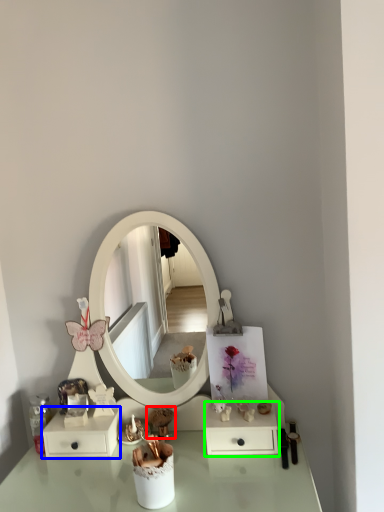
Question: Estimate the real-world distances between objects in this image. Which object is closer to toy (highlighted by a red box), dresser (highlighted by a blue box) or dresser (highlighted by a green box)?

Choices:
 (A) dresser
 (B) dresser

Answer: (A)